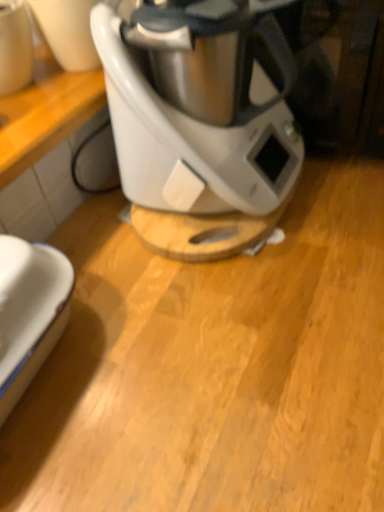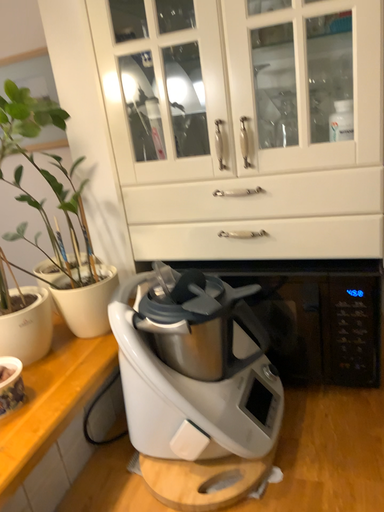
Question: Which way did the camera rotate in the video?

Choices:
 (A) rotated upward
 (B) rotated downward

Answer: (A)